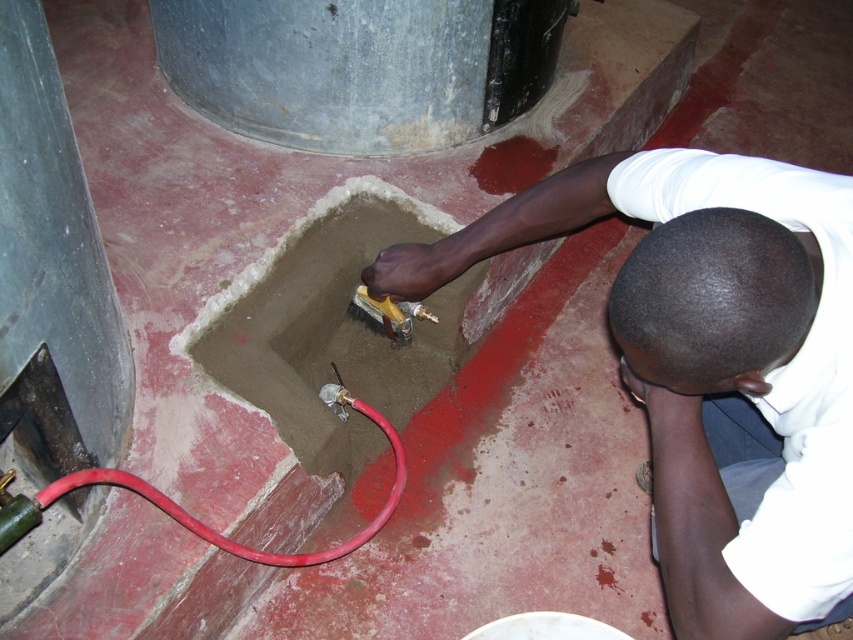
You are a construction worker inspecting a concrete pit. You notice a point marked at coordinates (332,330). Based on the scene description, where is this point located?

The point at coordinates (332,330) is located on the smooth concrete hole at center.